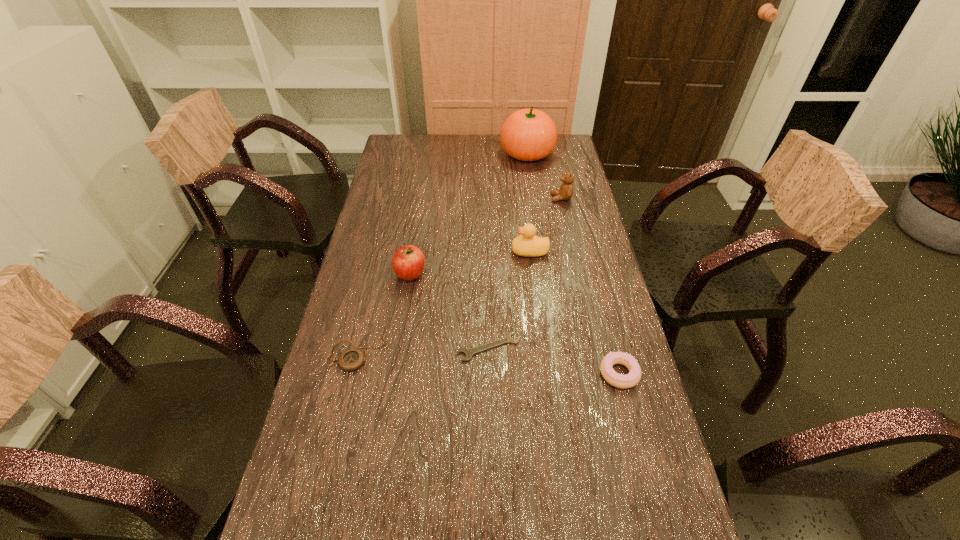
Where is `the tallest object`? the tallest object is located at coordinates (529, 134).

Locate an element on the screen. the farthest object is located at coordinates (529, 134).

Where is `teddy bear`? teddy bear is located at coordinates (566, 189).

Where is `the third farthest object`? This screenshot has height=540, width=960. the third farthest object is located at coordinates (528, 245).

Identify the location of the fourth nearest object. The height and width of the screenshot is (540, 960). (408, 262).

Find the location of a particular element. The height and width of the screenshot is (540, 960). doughnut is located at coordinates (617, 380).

Image resolution: width=960 pixels, height=540 pixels. In order to click on pocket watch in this screenshot , I will do `click(351, 359)`.

You are a GUI agent. You are given a task and a screenshot of the screen. Output one action in this format:
    pyautogui.click(x=<x>, y=<y>)
    Task: Click on the shortest object
    This screenshot has height=540, width=960.
    Given the screenshot: What is the action you would take?
    pyautogui.click(x=469, y=352)

Where is `free spot located on the right of the pumpkin`? free spot located on the right of the pumpkin is located at coordinates (574, 153).

Locate an element on the screen. The width and height of the screenshot is (960, 540). free space located on the face of the teddy bear is located at coordinates click(x=454, y=198).